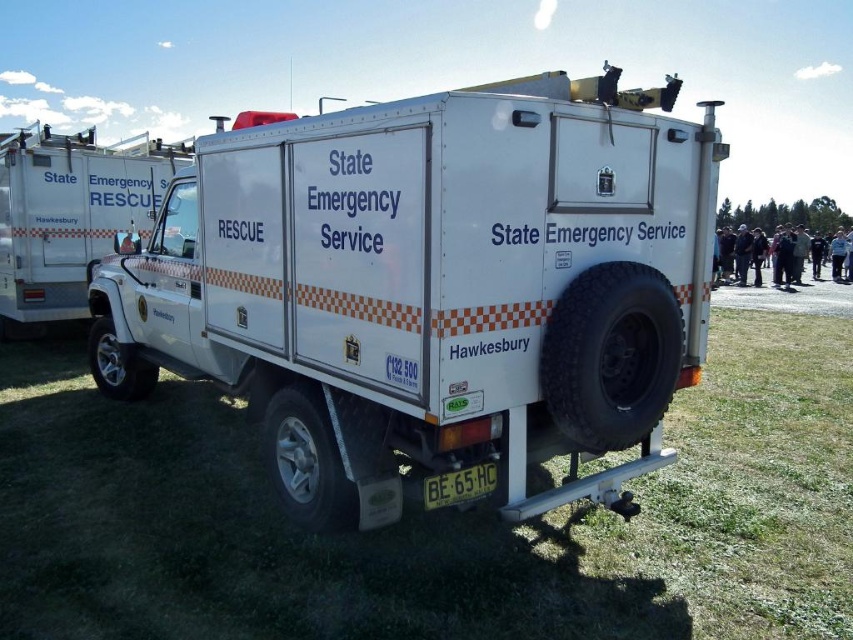
Question: From the image, what is the correct spatial relationship of green grass at lower center in relation to yellow metallic license plate at lower center?

Choices:
 (A) left
 (B) right

Answer: (A)

Question: In this image, where is white matte rescue vehicle at center located relative to green grass at lower center?

Choices:
 (A) above
 (B) below

Answer: (A)

Question: Does green grass at lower center have a larger size compared to yellow metallic license plate at lower center?

Choices:
 (A) yes
 (B) no

Answer: (A)

Question: Among these objects, which one is farthest from the camera?

Choices:
 (A) white matte rescue vehicle at center
 (B) green grass at lower center

Answer: (B)

Question: Among these objects, which one is farthest from the camera?

Choices:
 (A) green grass at lower center
 (B) white matte rescue vehicle at center
 (C) yellow metallic license plate at lower center

Answer: (C)

Question: Among these points, which one is farthest from the camera?

Choices:
 (A) 846,380
 (B) 444,481
 (C) 697,172

Answer: (A)